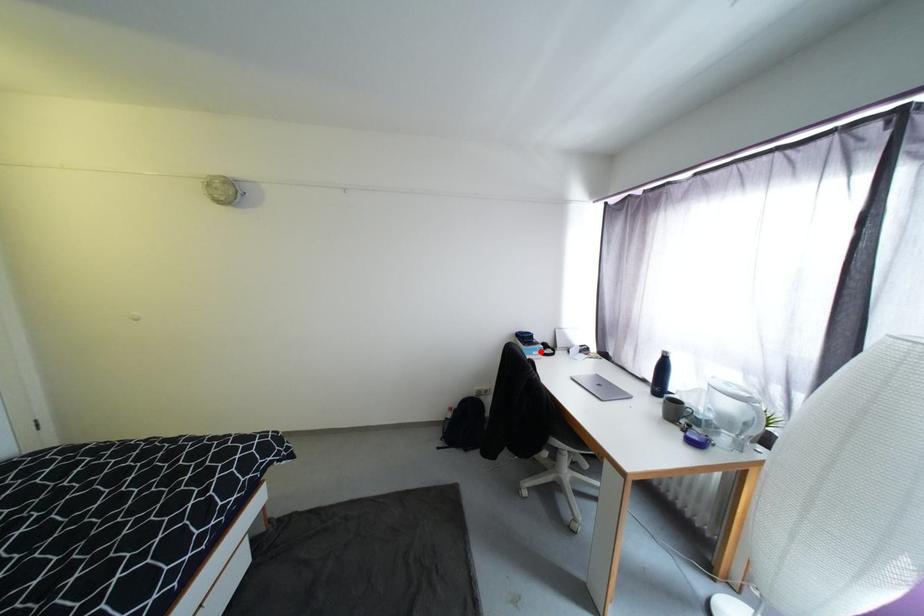
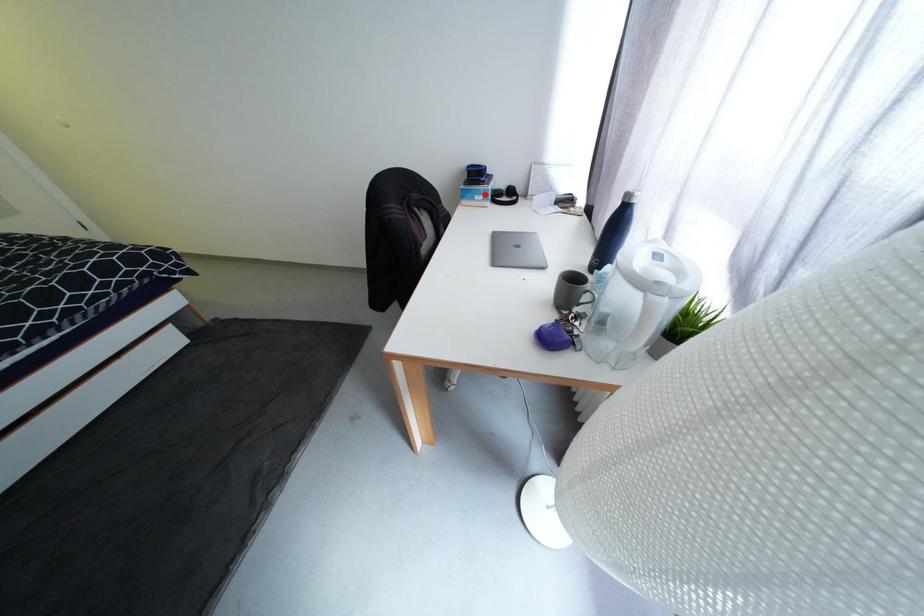
I am providing you with two images of the same scene from different viewpoints. A red point is marked on the first image and another point is marked on the second image. Is the red point in image1 aligned with the point shown in image2?

Yes